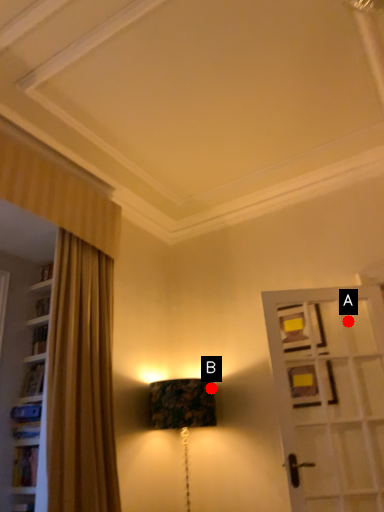
Question: Two points are circled on the image, labeled by A and B beside each circle. Which point appears closest to the camera in this image?

Choices:
 (A) A is closer
 (B) B is closer

Answer: (A)